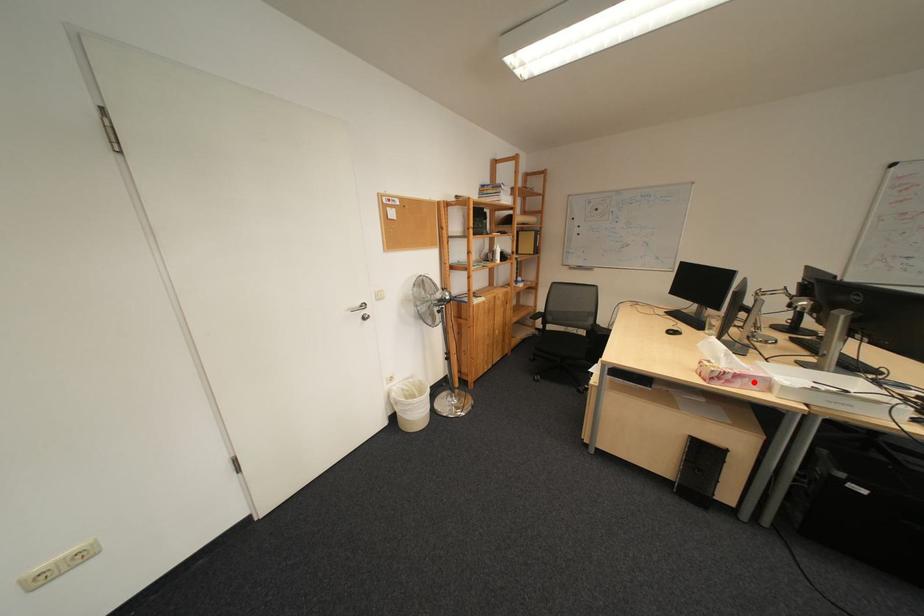
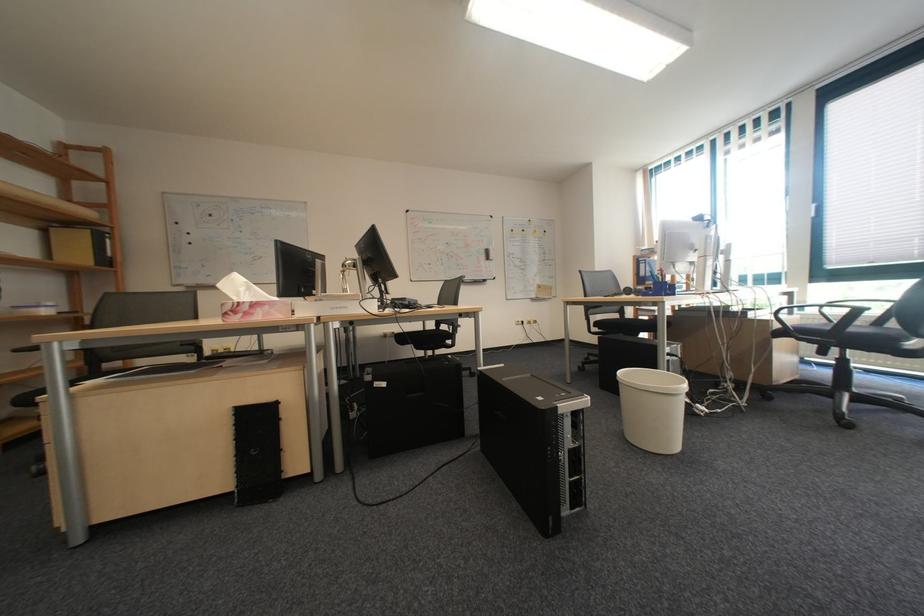
Where in the second image is the point corresponding to the highlighted location from the first image?

(273, 312)